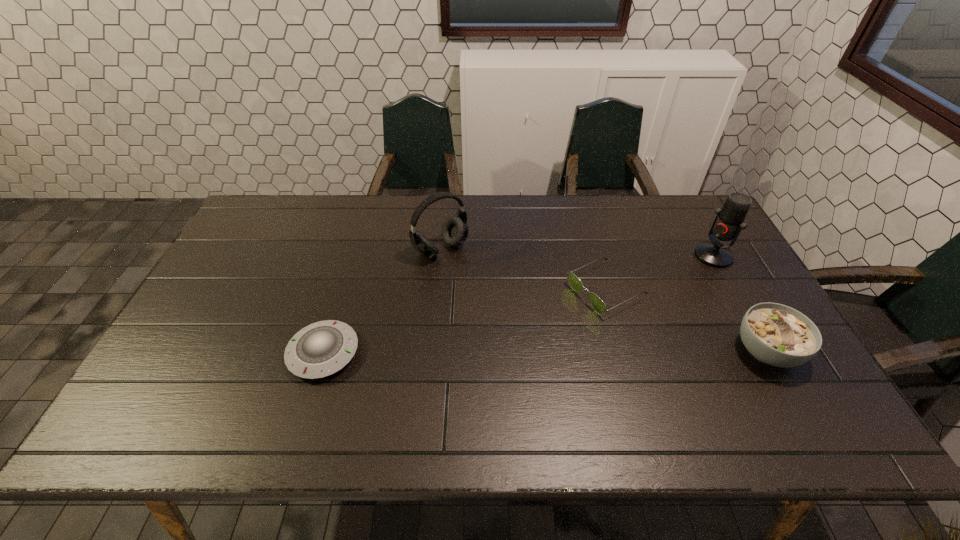
Image resolution: width=960 pixels, height=540 pixels. What are the coordinates of `soup bowl that is at the right edge` in the screenshot? It's located at click(x=778, y=335).

Locate an element on the screen. This screenshot has width=960, height=540. microphone at the right edge is located at coordinates pos(729,222).

Where is `object that is at the near right corner`? This screenshot has width=960, height=540. object that is at the near right corner is located at coordinates (778, 335).

Image resolution: width=960 pixels, height=540 pixels. In the image, there is a desktop. What are the coordinates of `vacant space at the far edge` in the screenshot? It's located at (377, 206).

This screenshot has height=540, width=960. What are the coordinates of `free space at the near edge` in the screenshot? It's located at (657, 375).

Locate an element on the screen. vacant point at the left edge is located at coordinates (259, 242).

Image resolution: width=960 pixels, height=540 pixels. Find the location of `vacant space at the right edge of the desktop`. vacant space at the right edge of the desktop is located at coordinates (753, 355).

Locate an element on the screen. This screenshot has width=960, height=540. vacant space at the near left corner is located at coordinates (153, 375).

The image size is (960, 540). I want to click on vacant space in between the second object from left to right and the third tallest object, so click(604, 300).

The image size is (960, 540). Identify the location of vacant space that's between the third object from left to right and the microphone. (660, 273).